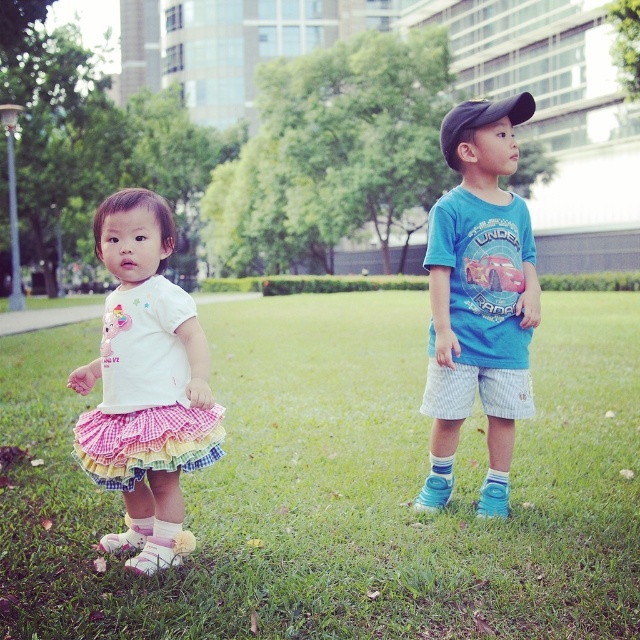
You are a photographer setting up for a group photo. You need to position the white cotton shirt at center and the pastel gingham ballet skirt at lower left so that they are side by side. Considering their sizes, which one should be placed on the side that requires more space?

The white cotton shirt at center should be placed on the side that requires more space because its width is larger than the pastel gingham ballet skirt at lower left.